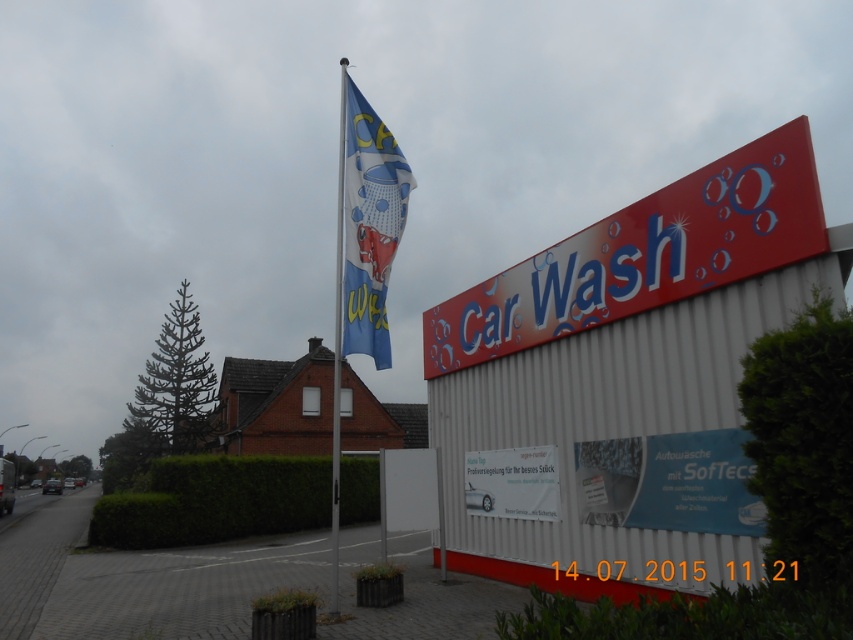
You are a customer approaching the car wash facility and want to read both the blue glossy signboard at center and the blue fabric flag at center. Which one should you look at first to see the main service information?

The blue glossy signboard at center is located below the blue fabric flag at center, so you should look at the blue fabric flag at center first as it is positioned higher up and likely contains the main service information.

You are standing in front of the car wash facility and want to take a photo. Which point, point [709,513] or point [349,234], will appear larger in the photo?

Point [709,513] will appear larger in the photo because it is closer to the camera than point [349,234].